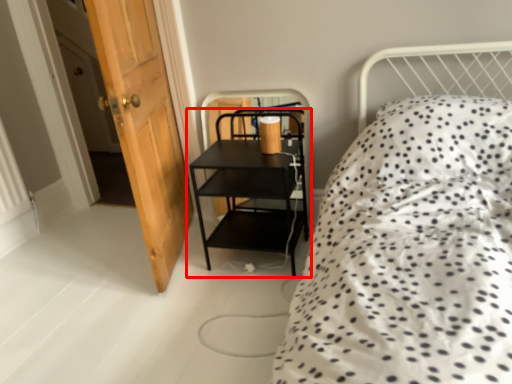
Question: In this image, where is shelf (annotated by the red box) located relative to door?

Choices:
 (A) left
 (B) right

Answer: (B)